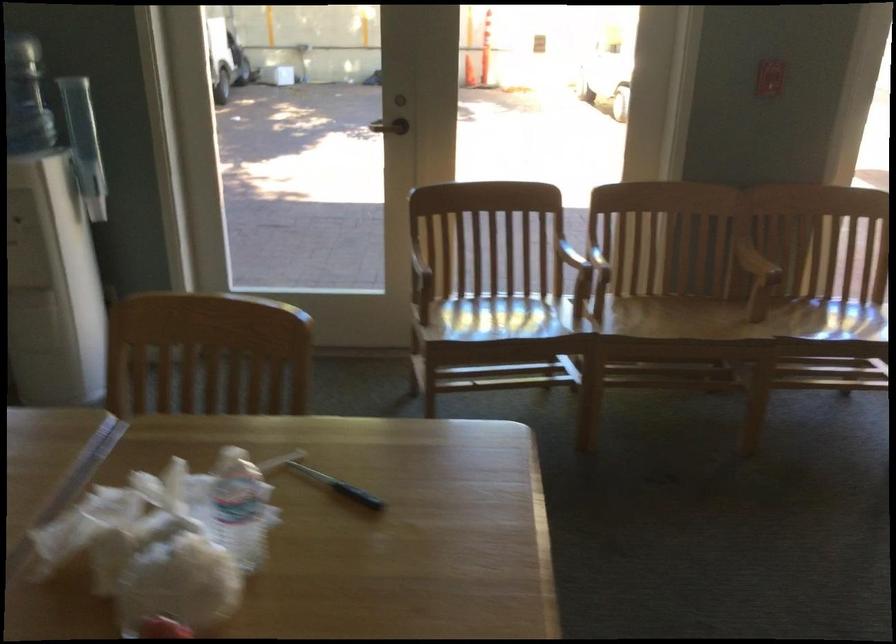
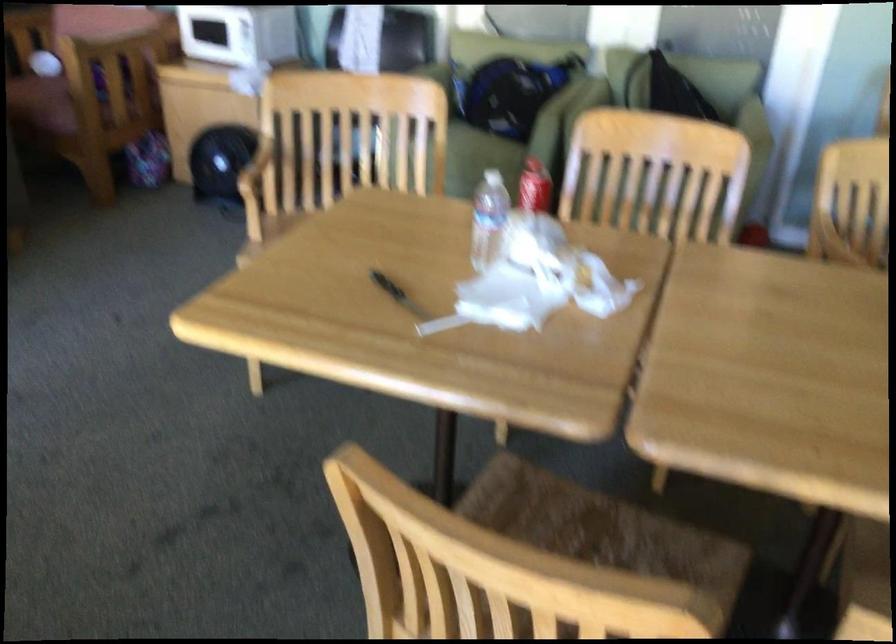
The point at (246, 536) is marked in the first image. Where is the corresponding point in the second image?

(398, 294)